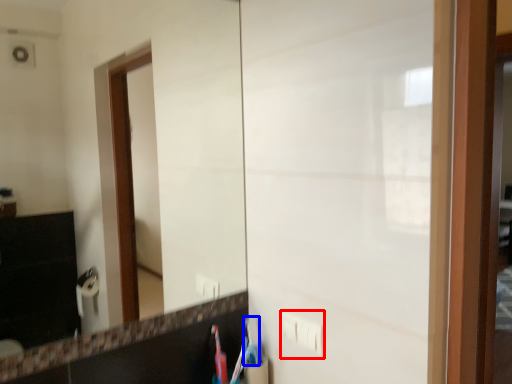
Question: Which of the following is the closest to the observer, electric outlet (highlighted by a red box) or toothbrush (highlighted by a blue box)?

Choices:
 (A) electric outlet
 (B) toothbrush

Answer: (A)